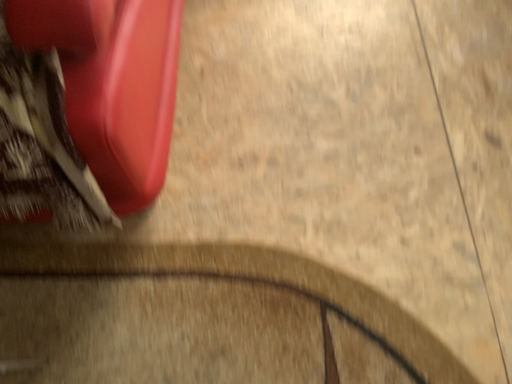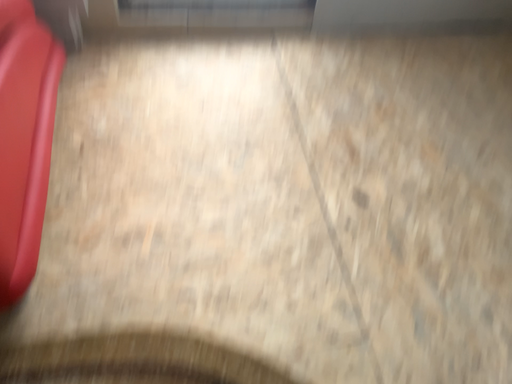
Question: How did the camera likely rotate when shooting the video?

Choices:
 (A) rotated left
 (B) rotated right

Answer: (B)